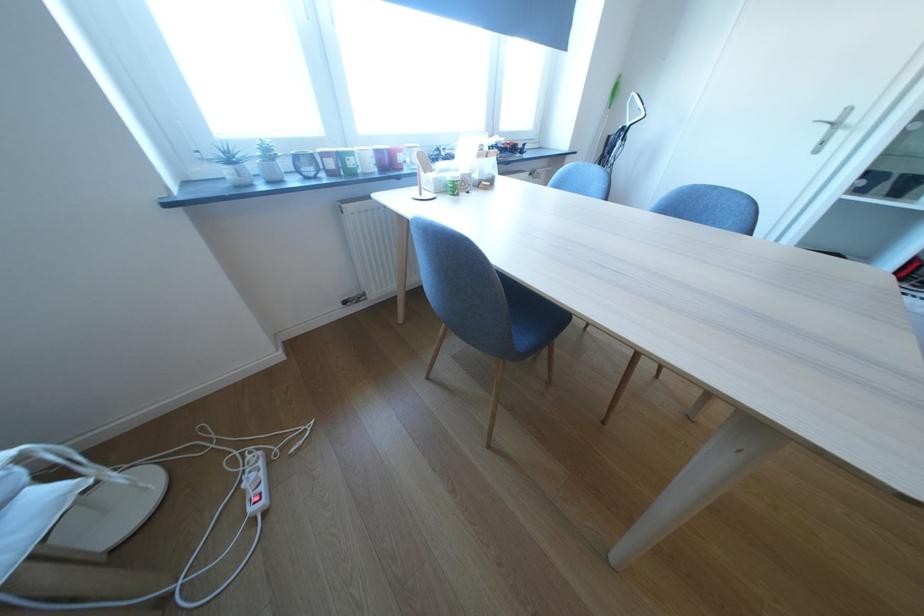
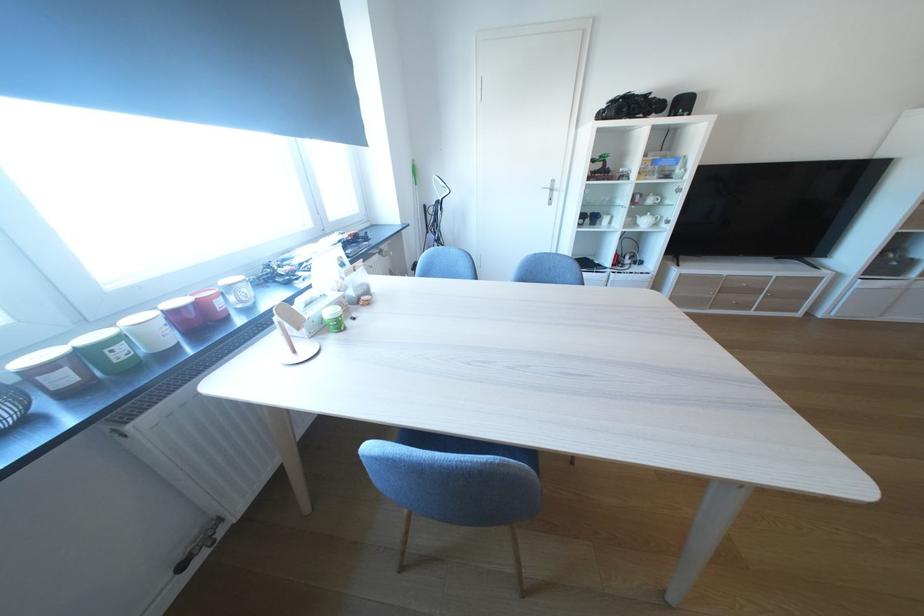
Locate, in the second image, the point that corresponds to point (361, 164) in the first image.

(129, 354)